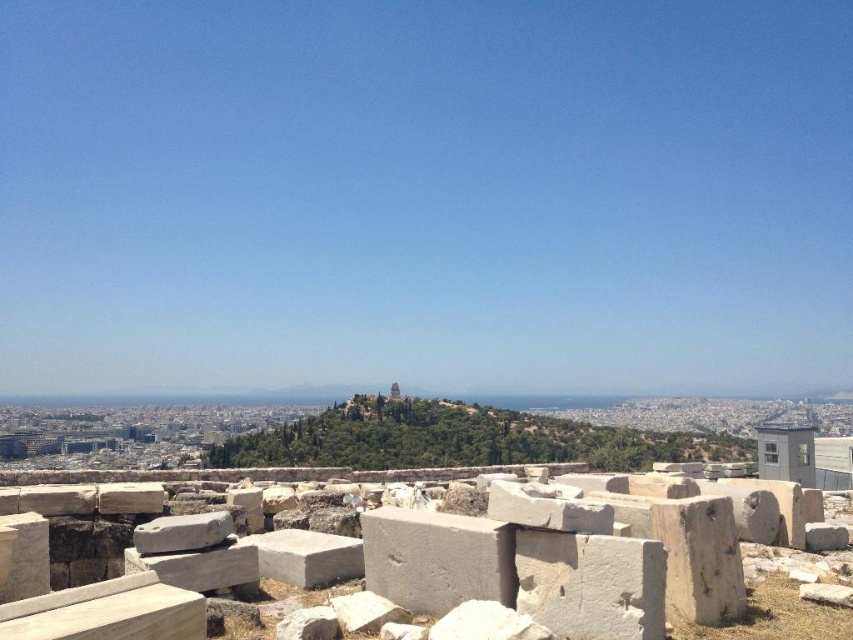
Question: Which of the following is the closest to the observer?

Choices:
 (A) white stone ruins at center
 (B) green leafy hillside at center

Answer: (A)

Question: Among these objects, which one is nearest to the camera?

Choices:
 (A) white stone ruins at center
 (B) green leafy hillside at center

Answer: (A)

Question: Which point is closer to the camera taking this photo?

Choices:
 (A) (653, 512)
 (B) (434, 445)

Answer: (A)

Question: Is white stone ruins at center to the left of green leafy hillside at center from the viewer's perspective?

Choices:
 (A) yes
 (B) no

Answer: (A)

Question: Can you confirm if white stone ruins at center is wider than green leafy hillside at center?

Choices:
 (A) yes
 (B) no

Answer: (B)

Question: Does white stone ruins at center have a lesser width compared to green leafy hillside at center?

Choices:
 (A) no
 (B) yes

Answer: (B)